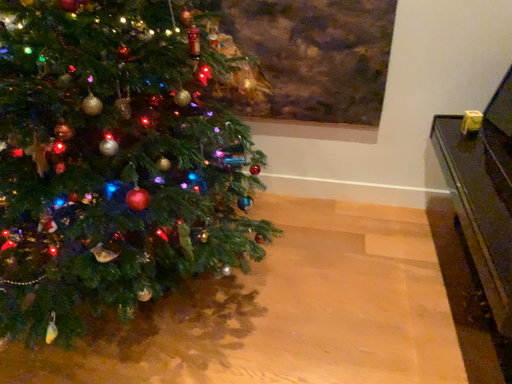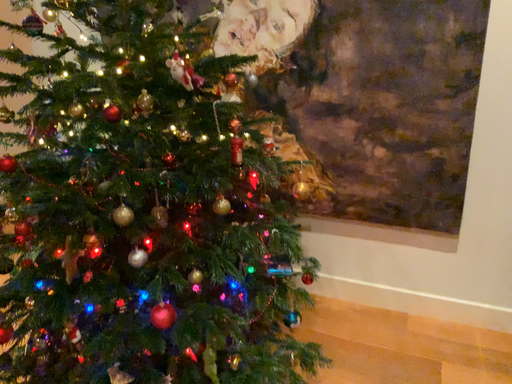
Question: How did the camera likely rotate when shooting the video?

Choices:
 (A) rotated upward
 (B) rotated downward

Answer: (A)